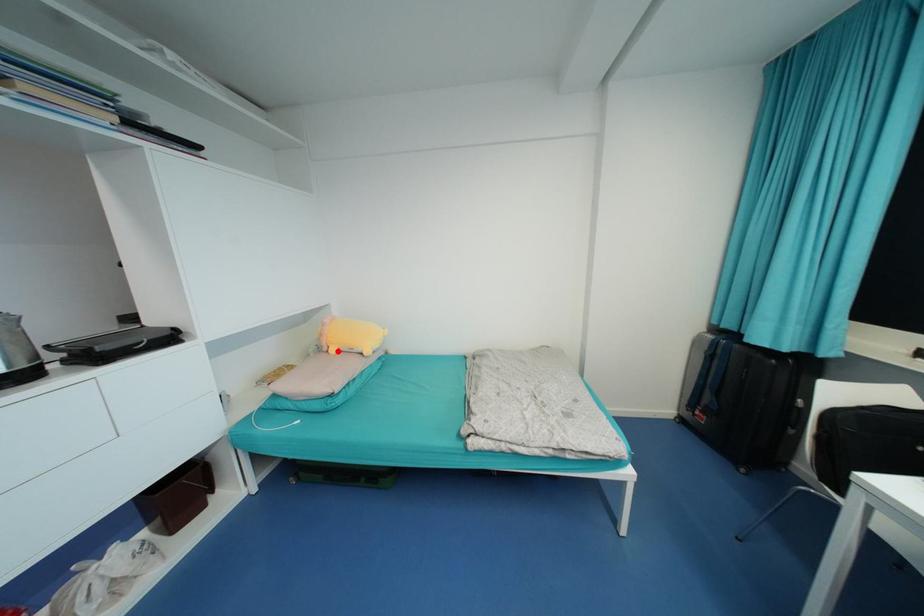
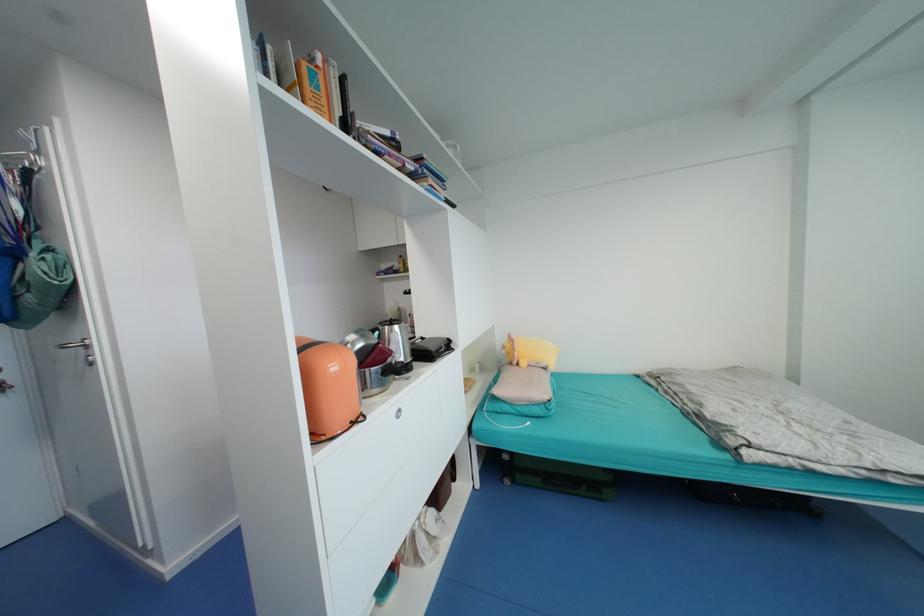
Question: I am providing you with two images of the same scene from different viewpoints. In image1, a red point is highlighted. Considering the same 3D point in image2, which of the following is correct?

Choices:
 (A) It is closer
 (B) It is farther

Answer: (B)